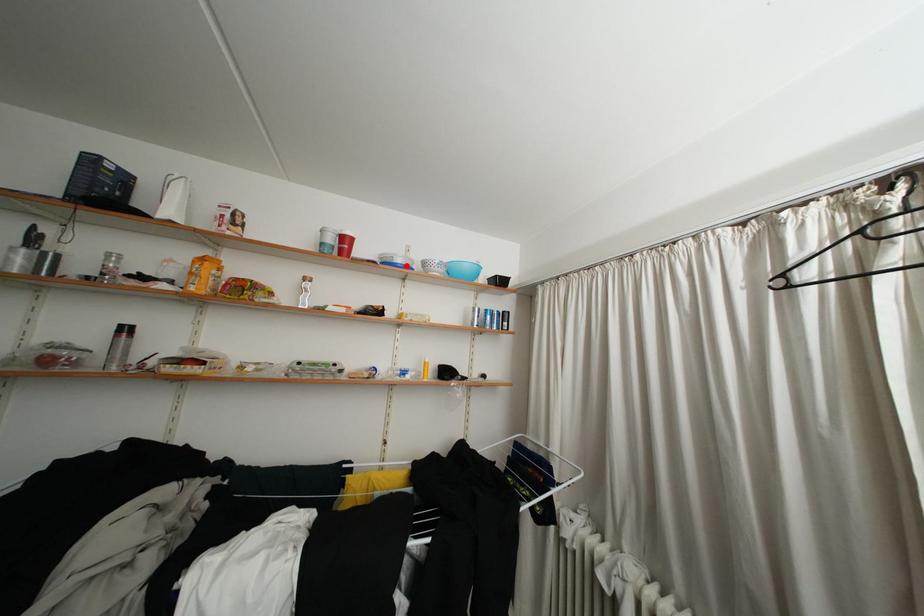
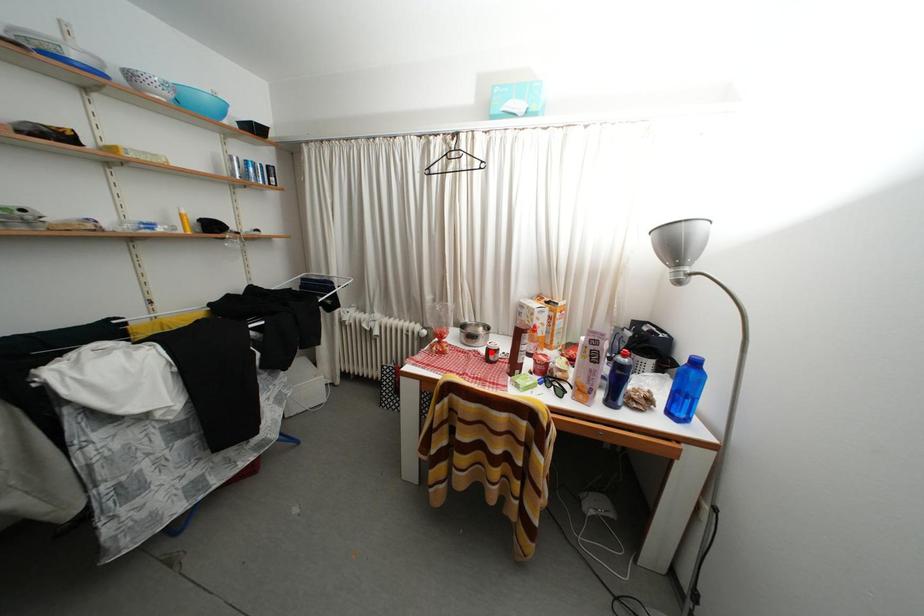
I am providing you with two images of the same scene from different viewpoints. A red point is marked on the first image and another point is marked on the second image. Is the red point in image1 aligned with the point shown in image2?

No